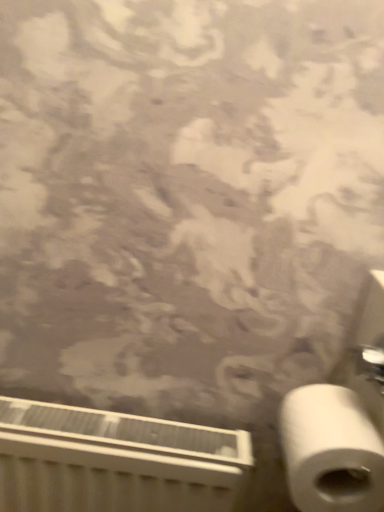
Question: Does white matte toilet paper at lower right lie behind white plastic radiator at lower left?

Choices:
 (A) no
 (B) yes

Answer: (A)

Question: Is white matte toilet paper at lower right closer to the viewer compared to white plastic radiator at lower left?

Choices:
 (A) yes
 (B) no

Answer: (A)

Question: Are white matte toilet paper at lower right and white plastic radiator at lower left beside each other?

Choices:
 (A) yes
 (B) no

Answer: (B)

Question: Does white matte toilet paper at lower right have a lesser width compared to white plastic radiator at lower left?

Choices:
 (A) no
 (B) yes

Answer: (A)

Question: Does white matte toilet paper at lower right have a lesser height compared to white plastic radiator at lower left?

Choices:
 (A) yes
 (B) no

Answer: (A)

Question: From a real-world perspective, is white matte toilet paper at lower right located higher than white plastic radiator at lower left?

Choices:
 (A) yes
 (B) no

Answer: (A)

Question: Is white plastic radiator at lower left wider than white matte toilet paper at lower right?

Choices:
 (A) no
 (B) yes

Answer: (A)

Question: Does white plastic radiator at lower left lie behind white matte toilet paper at lower right?

Choices:
 (A) no
 (B) yes

Answer: (B)

Question: Does white plastic radiator at lower left appear on the right side of white matte toilet paper at lower right?

Choices:
 (A) yes
 (B) no

Answer: (B)

Question: Can you confirm if white plastic radiator at lower left is thinner than white matte toilet paper at lower right?

Choices:
 (A) no
 (B) yes

Answer: (B)

Question: Is white plastic radiator at lower left facing towards white matte toilet paper at lower right?

Choices:
 (A) no
 (B) yes

Answer: (A)

Question: From a real-world perspective, is white plastic radiator at lower left located higher than white matte toilet paper at lower right?

Choices:
 (A) no
 (B) yes

Answer: (A)

Question: In the image, is white plastic radiator at lower left on the left side or the right side of white matte toilet paper at lower right?

Choices:
 (A) left
 (B) right

Answer: (A)